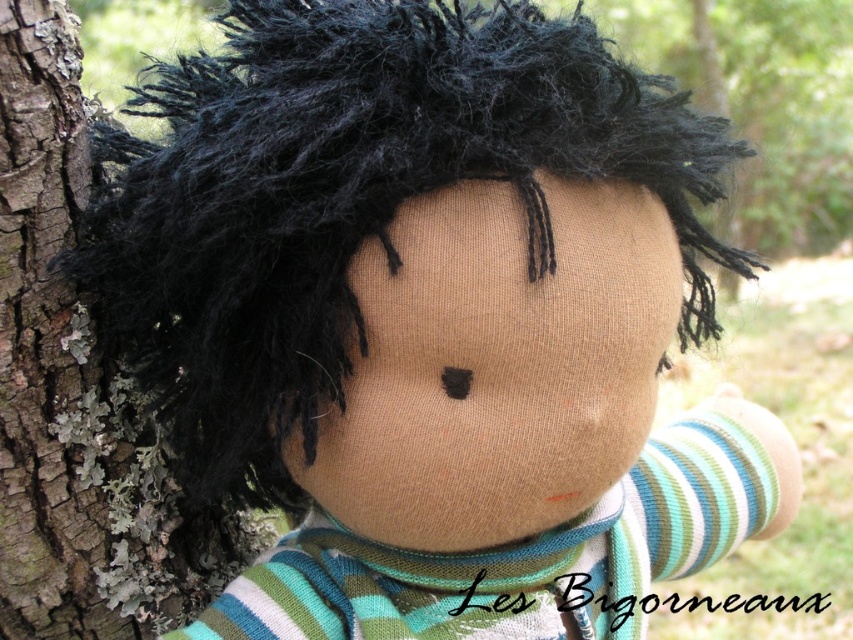
Question: Does black fuzzy hair at center have a greater width compared to rough bark tree trunk at left?

Choices:
 (A) no
 (B) yes

Answer: (B)

Question: Which object appears farthest from the camera in this image?

Choices:
 (A) rough bark tree trunk at left
 (B) black fuzzy hair at center

Answer: (A)

Question: Does black fuzzy hair at center appear on the left side of rough bark tree trunk at left?

Choices:
 (A) yes
 (B) no

Answer: (B)

Question: Which object is farther from the camera taking this photo?

Choices:
 (A) black fuzzy hair at center
 (B) rough bark tree trunk at left

Answer: (B)

Question: Does black fuzzy hair at center have a greater width compared to rough bark tree trunk at left?

Choices:
 (A) yes
 (B) no

Answer: (A)